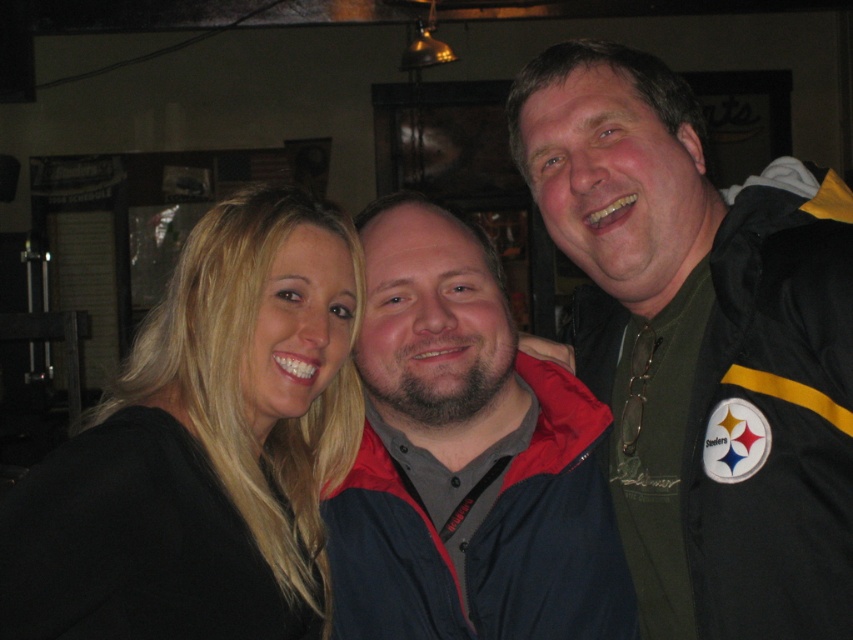
Question: Which of the following is the farthest from the observer?

Choices:
 (A) (212, 465)
 (B) (648, 394)

Answer: (B)

Question: Estimate the real-world distances between objects in this image. Which object is farther from the dark blue jacket at center?

Choices:
 (A) black fabric jacket at right
 (B) black matte hair at center

Answer: (A)

Question: Which object appears farthest from the camera in this image?

Choices:
 (A) dark blue jacket at center
 (B) black matte hair at center
 (C) black fabric jacket at right

Answer: (A)

Question: Can you confirm if black matte hair at center is positioned above dark blue jacket at center?

Choices:
 (A) yes
 (B) no

Answer: (B)

Question: Does black matte hair at center have a larger size compared to dark blue jacket at center?

Choices:
 (A) yes
 (B) no

Answer: (A)

Question: Is black fabric jacket at right positioned at the back of black matte hair at center?

Choices:
 (A) yes
 (B) no

Answer: (A)